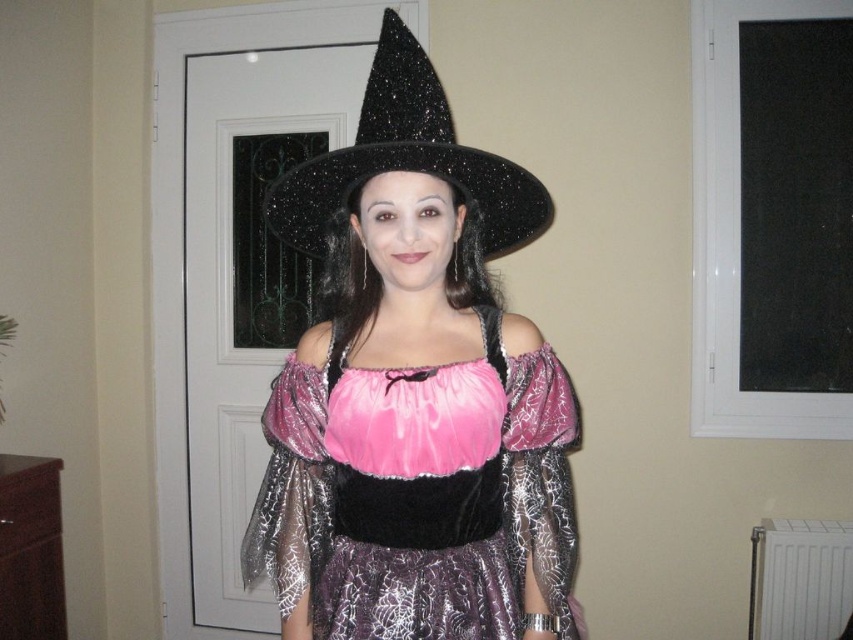
Looking at this image, you are taking a photo of the witch costume and notice two points on the image. The first point is at coordinate point (357, 545) and the second is at point (274, 211). Which point is nearer to the camera?

Point (357, 545) is closer to the camera than point (274, 211).

You are a costume designer measuring the distance between the pink satin dress at center and the black glittery witch hat at center for a Halloween parade. The parade requires that the hat must be at least 12 inches away from the dress to avoid tangling. Is the current distance sufficient?

The distance between the pink satin dress at center and the black glittery witch hat at center is 12.67 inches, which exceeds the required 12 inches. Therefore, the current distance is sufficient to prevent tangling during the parade.

You are trying to locate the pink satin dress at center in the image. According to the coordinates given, where would you find it?

The pink satin dress at center is located at coordinates point (419, 496).